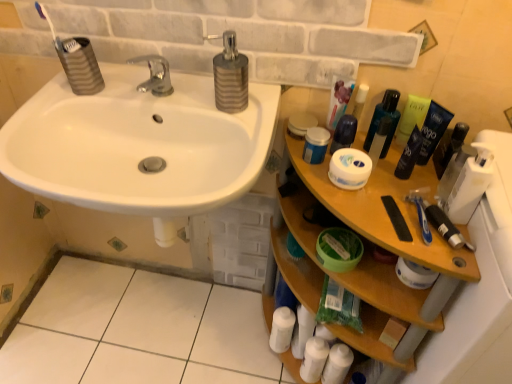
You are a GUI agent. You are given a task and a screenshot of the screen. Output one action in this format:
    pyautogui.click(x=<x>, y=<y>)
    Task: Click on the vacant area that is in front of white matte jar at upper right, the third toiletry in the back-to-front sequence
    
    Given the screenshot: What is the action you would take?
    pyautogui.click(x=392, y=207)